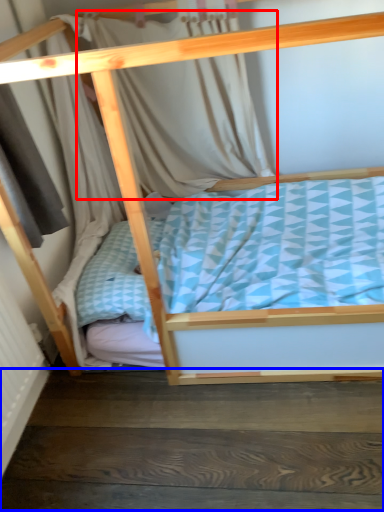
Question: Which object appears farthest to the camera in this image, curtain (highlighted by a red box) or stair (highlighted by a blue box)?

Choices:
 (A) curtain
 (B) stair

Answer: (A)